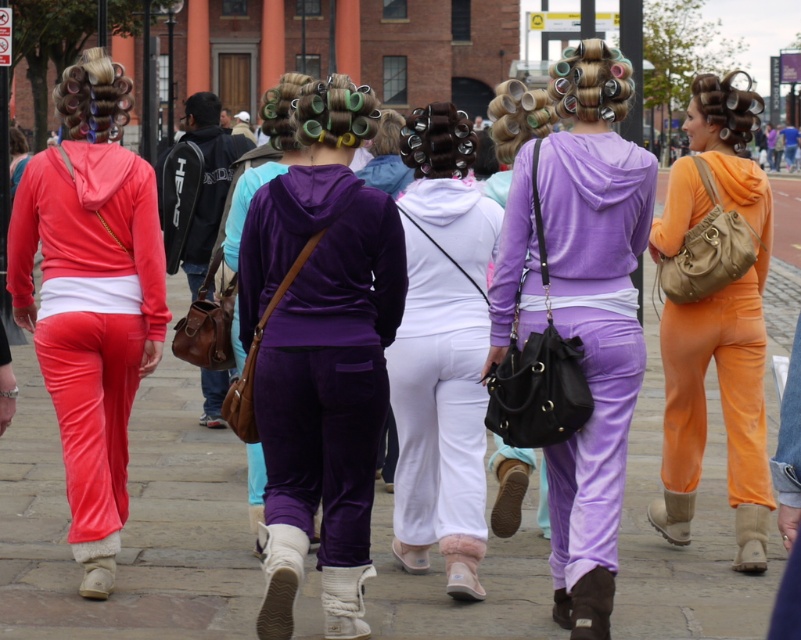
Is white matte pants at center to the left of purple velvet pants at center from the viewer's perspective?

Indeed, white matte pants at center is positioned on the left side of purple velvet pants at center.

Which of these two, white matte pants at center or purple velvet pants at center, stands shorter?

Standing shorter between the two is white matte pants at center.

The width and height of the screenshot is (801, 640). I want to click on white matte pants at center, so click(x=441, y=352).

Is velvet purple hoodie at center positioned behind orange velour jumpsuit at center?

No, velvet purple hoodie at center is closer to the viewer.

Can you confirm if velvet purple hoodie at center is bigger than orange velour jumpsuit at center?

Incorrect, velvet purple hoodie at center is not larger than orange velour jumpsuit at center.

Who is more forward, (327, 460) or (755, 195)?

Positioned in front is point (327, 460).

Identify the location of velvet purple hoodie at center. This screenshot has height=640, width=801. (321, 355).

Between point (220, 536) and point (139, 337), which one is positioned behind?

Point (220, 536)

Does matte concrete pavement at center have a greater width compared to matte velour pants at left?

Yes, matte concrete pavement at center is wider than matte velour pants at left.

Does point (771, 449) come closer to viewer compared to point (85, 385)?

That is False.

You are a GUI agent. You are given a task and a screenshot of the screen. Output one action in this format:
    pyautogui.click(x=<x>, y=<y>)
    Task: Click on the matte concrete pavement at center
    The image size is (801, 640).
    Given the screenshot: What is the action you would take?
    pyautogui.click(x=129, y=522)